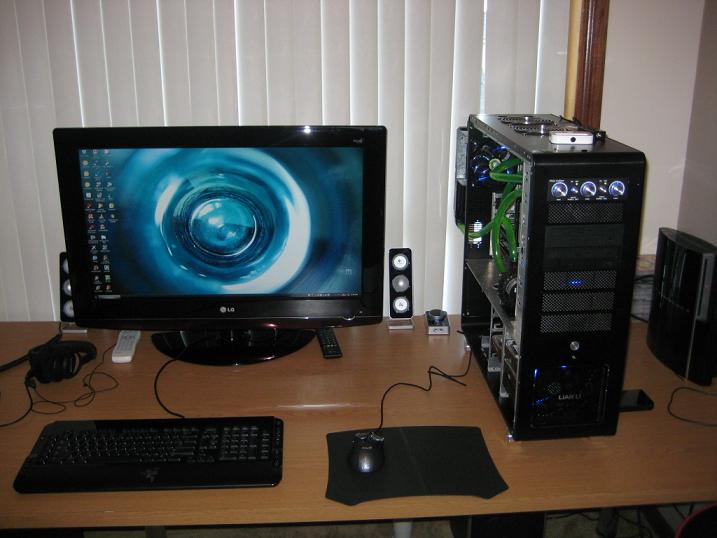
You are a GUI agent. You are given a task and a screenshot of the screen. Output one action in this format:
    pyautogui.click(x=<x>, y=<y>)
    Task: Click on the desk
    The width and height of the screenshot is (717, 538).
    Given the screenshot: What is the action you would take?
    pyautogui.click(x=320, y=408)